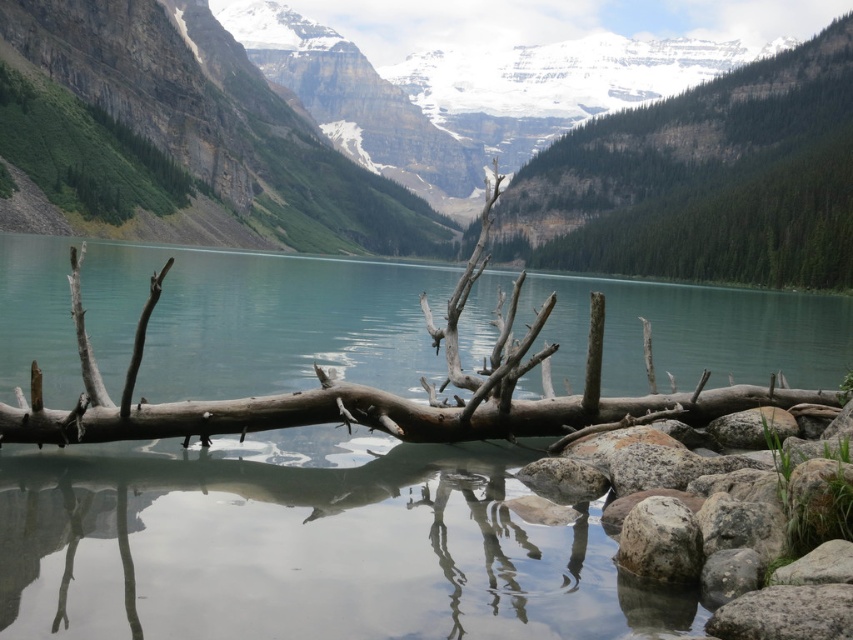
Question: Which point appears farthest from the camera in this image?

Choices:
 (A) (834, 625)
 (B) (621, 612)

Answer: (B)

Question: Which of the following is the closest to the observer?

Choices:
 (A) (553, 282)
 (B) (775, 205)
 (C) (631, 532)
 (D) (791, 605)

Answer: (D)

Question: Does gray rough rock at lower right have a smaller size compared to gray rough rock at lower center?

Choices:
 (A) yes
 (B) no

Answer: (A)

Question: Can you confirm if green textured tree at upper center is thinner than gray rough rock at lower right?

Choices:
 (A) yes
 (B) no

Answer: (B)

Question: Which object is the closest to the gray rough rock at lower right?

Choices:
 (A) gray rough rock at lower center
 (B) clear water at center
 (C) green textured tree at upper center

Answer: (A)

Question: Is gray rough rock at lower right smaller than gray rough rock at lower center?

Choices:
 (A) yes
 (B) no

Answer: (A)